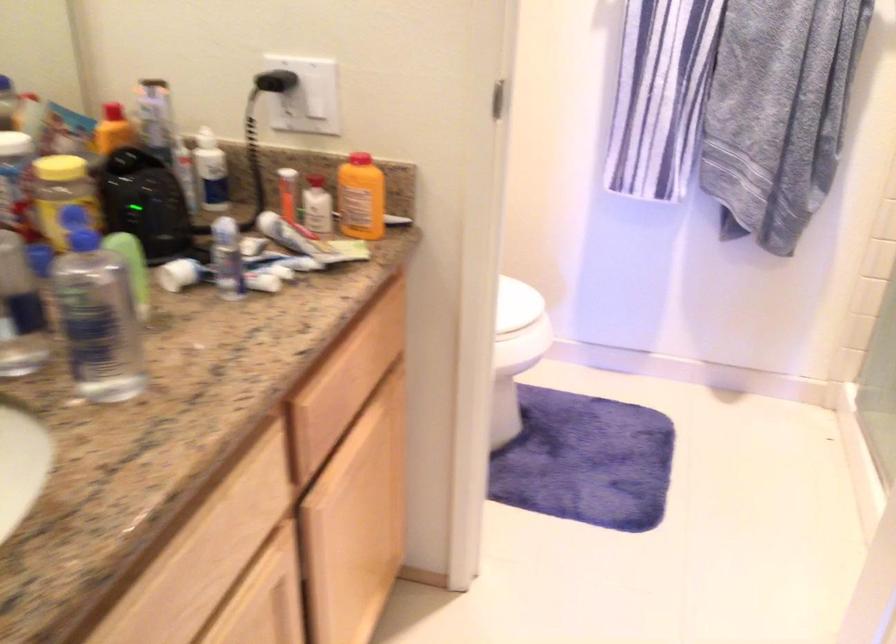
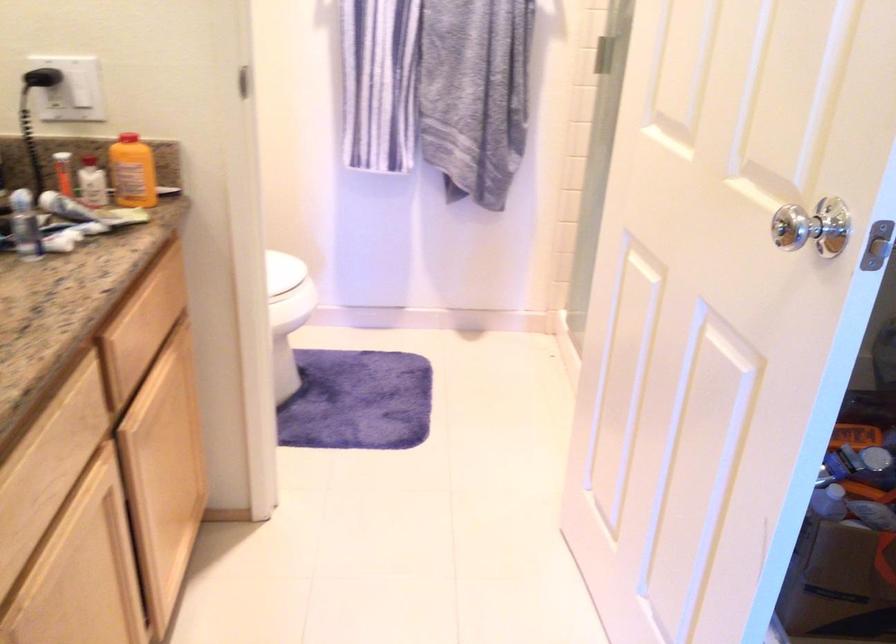
In the second image, find the point that corresponds to the point at 305,97 in the first image.

(76, 88)